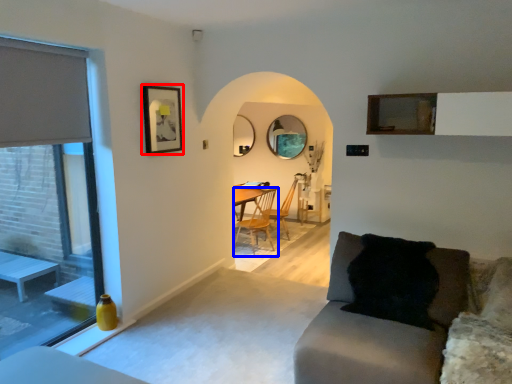
Question: Which object appears closest to the camera in this image, picture frame (highlighted by a red box) or chair (highlighted by a blue box)?

Choices:
 (A) picture frame
 (B) chair

Answer: (A)